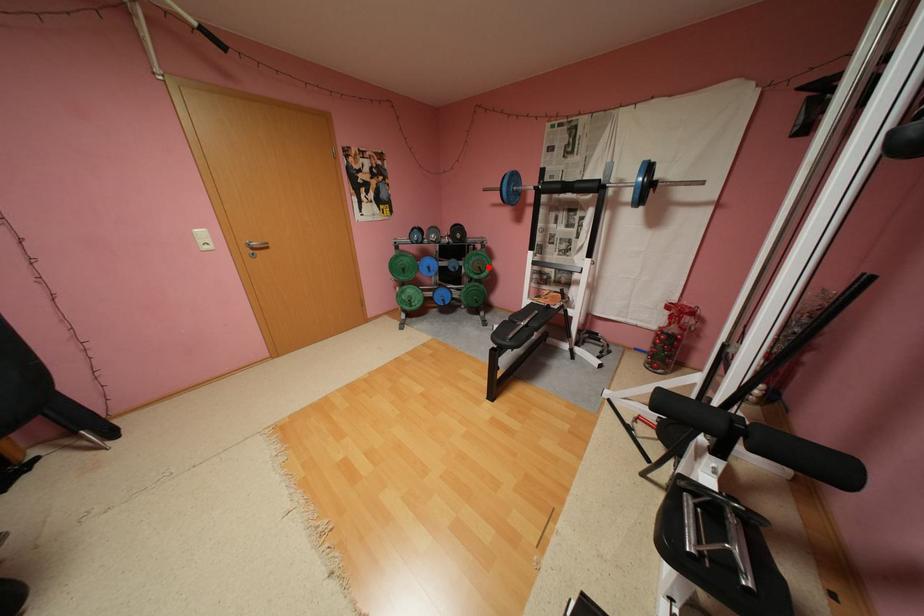
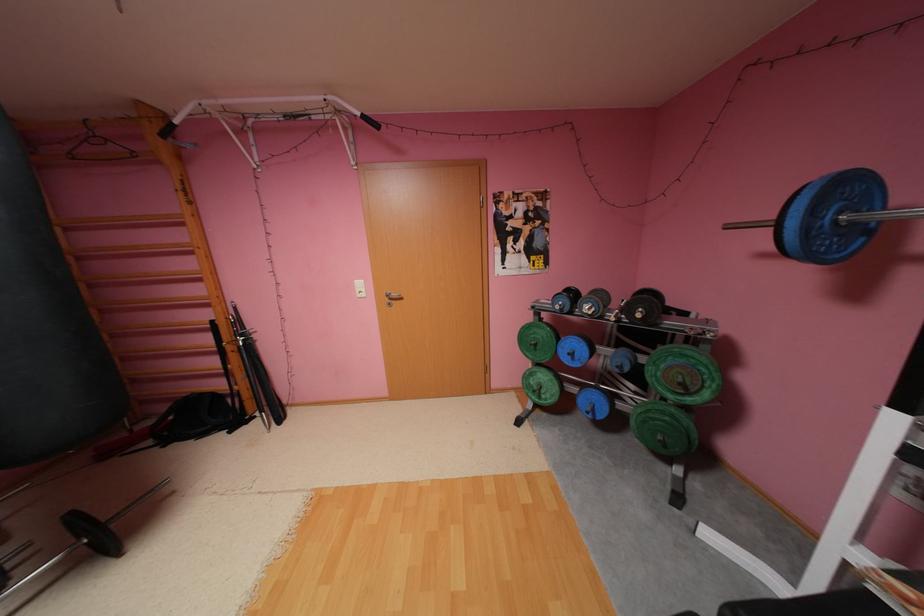
Find the pixel in the second image that matches the highlighted location in the first image.

(690, 384)